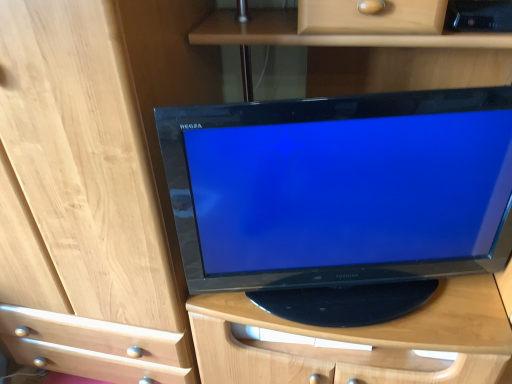
In order to face black glossy tv at center, should I rotate leftwards or rightwards?

It's best to rotate right around 12.789 degrees.

Where is `black glossy tv at center`? The width and height of the screenshot is (512, 384). black glossy tv at center is located at coordinates (x=341, y=198).

What is the approximate height of black glossy tv at center?

It is 58.67 centimeters.

Describe the element at coordinates (341, 198) in the screenshot. I see `black glossy tv at center` at that location.

The height and width of the screenshot is (384, 512). In order to click on black glossy tv at center in this screenshot , I will do `click(341, 198)`.